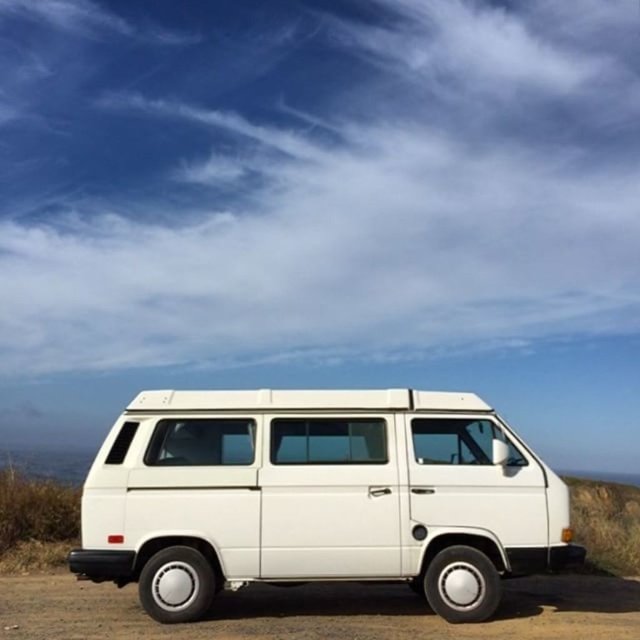
Question: Which point appears closest to the camera in this image?

Choices:
 (A) (164, 481)
 (B) (44, 596)

Answer: (A)

Question: Can you confirm if white matte van at center is positioned to the right of white rubber tire at lower center?

Choices:
 (A) yes
 (B) no

Answer: (B)

Question: Does white matte van at center appear under white rubber tire at lower center?

Choices:
 (A) no
 (B) yes

Answer: (A)

Question: Can you confirm if white matte van at center is positioned above white rubber tire at lower center?

Choices:
 (A) yes
 (B) no

Answer: (A)